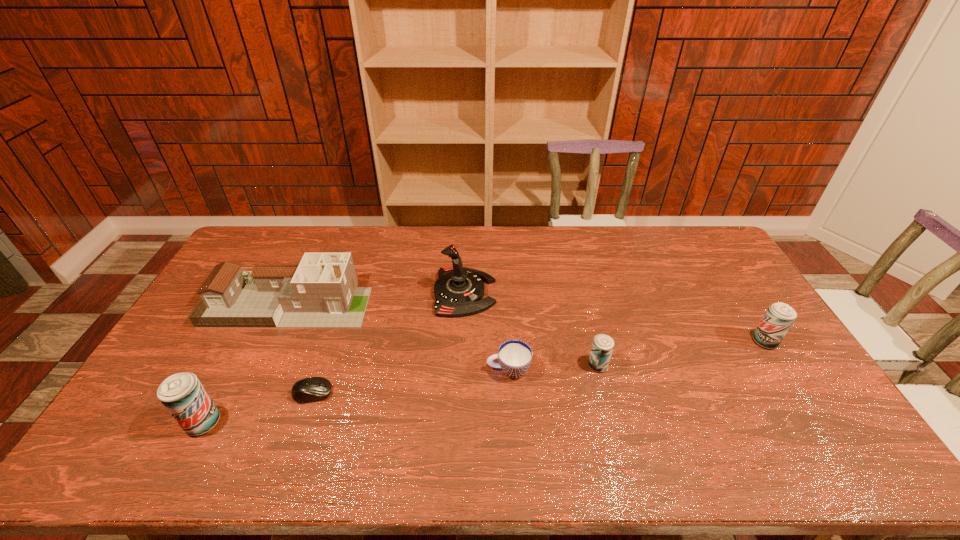
This screenshot has height=540, width=960. What are the coordinates of `mouse present at the near edge` in the screenshot? It's located at (311, 389).

Identify the location of beer can that is at the left edge. (182, 394).

This screenshot has width=960, height=540. I want to click on dollhouse positioned at the left edge, so 321,292.

Find the location of a particular element. This screenshot has height=540, width=960. object located in the right edge section of the desktop is located at coordinates (779, 317).

Where is `object that is at the near left corner`? object that is at the near left corner is located at coordinates (182, 394).

In the image, there is a desktop. Where is `blank space at the far edge`? The image size is (960, 540). blank space at the far edge is located at coordinates [x=606, y=260].

In the image, there is a desktop. Find the location of `free region at the near edge`. free region at the near edge is located at coordinates (539, 427).

This screenshot has width=960, height=540. Find the location of `free space at the left edge of the desktop`. free space at the left edge of the desktop is located at coordinates (194, 334).

In order to click on vacant space at the right edge in this screenshot , I will do (x=726, y=293).

Locate an element on the screen. This screenshot has width=960, height=540. free location at the far right corner is located at coordinates (708, 248).